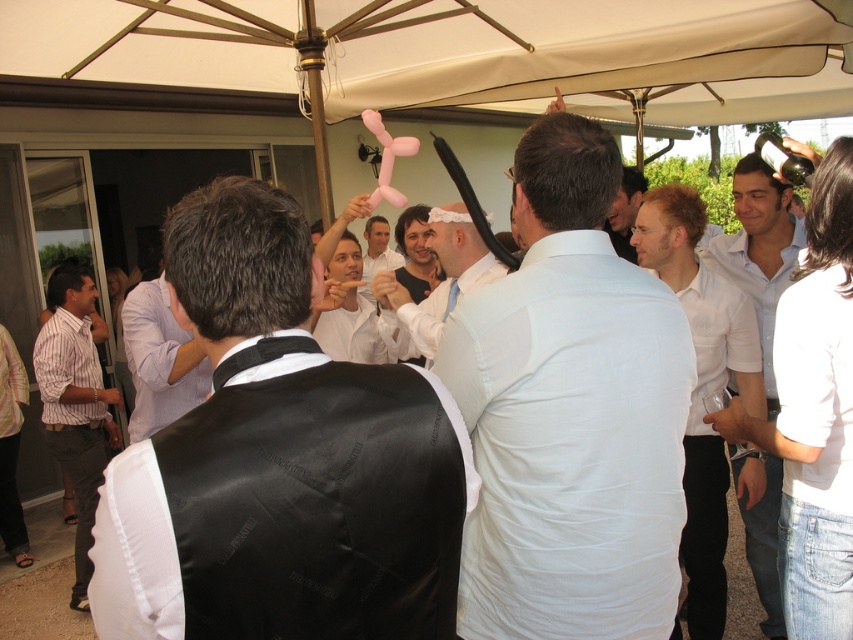
You are organizing a clothing donation drive and need to categorize shirts by size. You have two shirts in front of you, the striped shirt at left and the white glossy shirt at center. Which shirt should you place in the large size bin?

The striped shirt at left is larger in size than the white glossy shirt at center, so you should place the striped shirt at left in the large size bin.

You are at the lively social gathering under the tent and want to move from your current position to the point marked as point (691,292). There is an obstacle at point (498,348). Will you need to go around the obstacle to reach your destination?

Yes, you will need to go around the obstacle at point (498,348) because it is closer to you than the destination point (691,292), blocking your path.